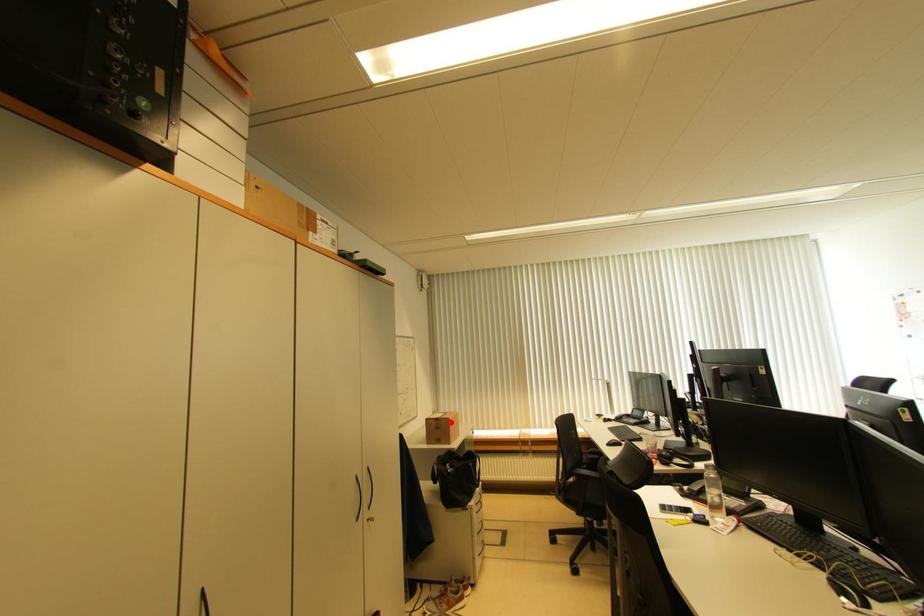
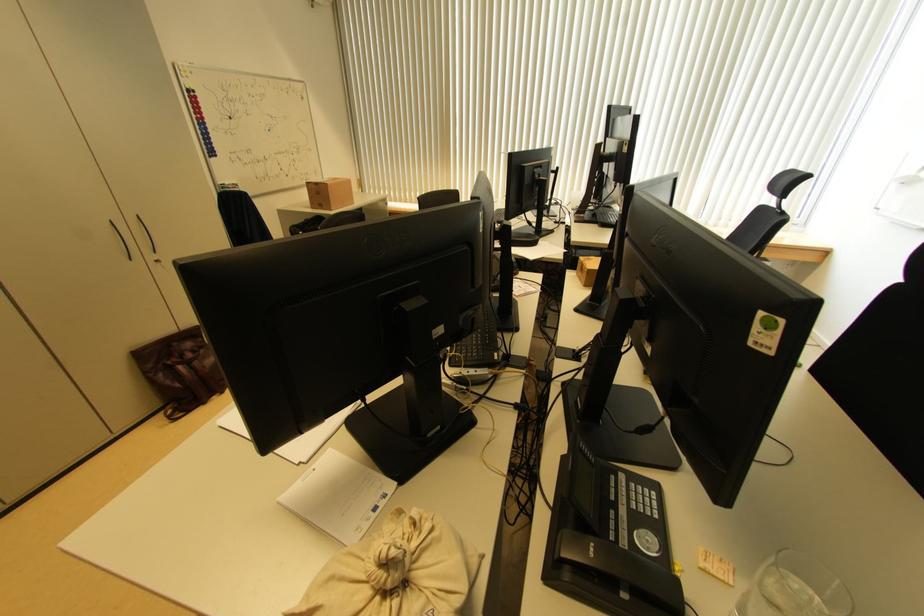
Where in the second image is the point corresponding to the highlighted location from the first image?

(329, 188)